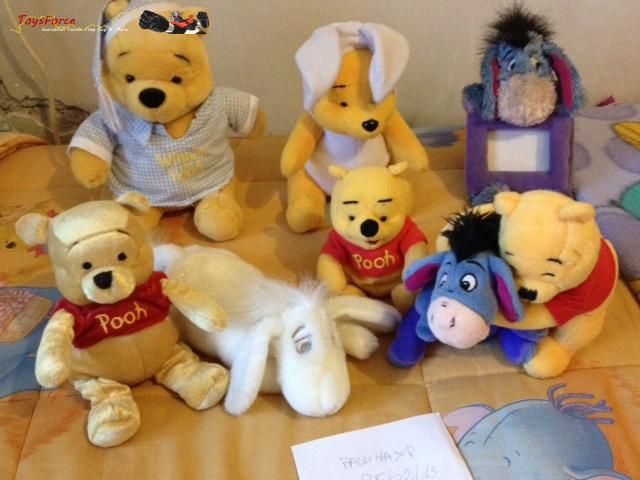
The image size is (640, 480). I want to click on stuffed animals, so click(x=522, y=83), click(x=532, y=231), click(x=472, y=280), click(x=374, y=208), click(x=358, y=109), click(x=171, y=75), click(x=256, y=299), click(x=108, y=260).